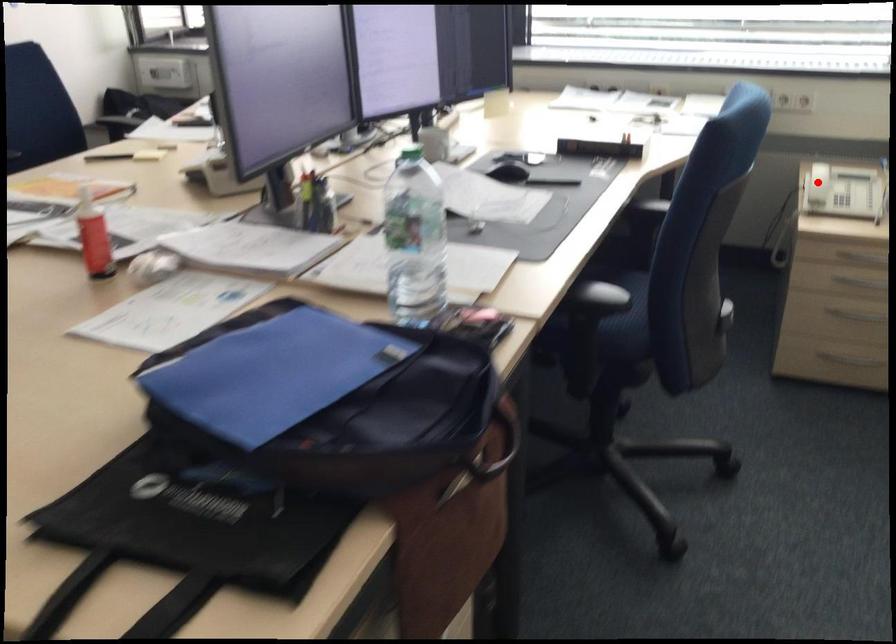
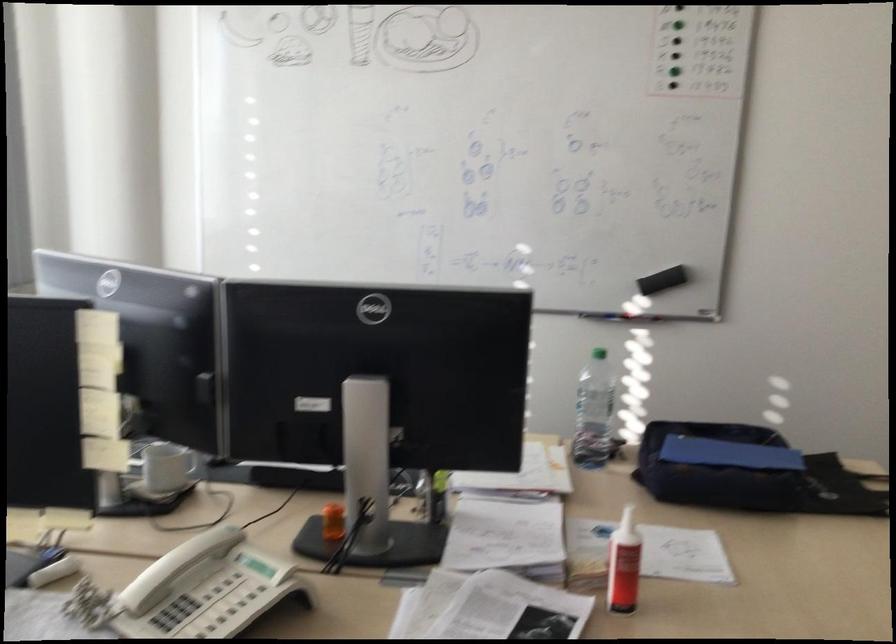
Question: I am providing you with two images of the same scene from different viewpoints. A red point is marked on the first image. Can you still see the location of the red point in image 2?

Choices:
 (A) Yes
 (B) No

Answer: (B)